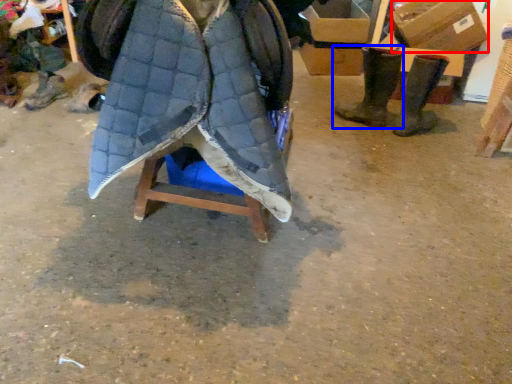
Question: Which of the following is the farthest to the observer, cardboard box (highlighted by a red box) or footwear (highlighted by a blue box)?

Choices:
 (A) cardboard box
 (B) footwear

Answer: (A)